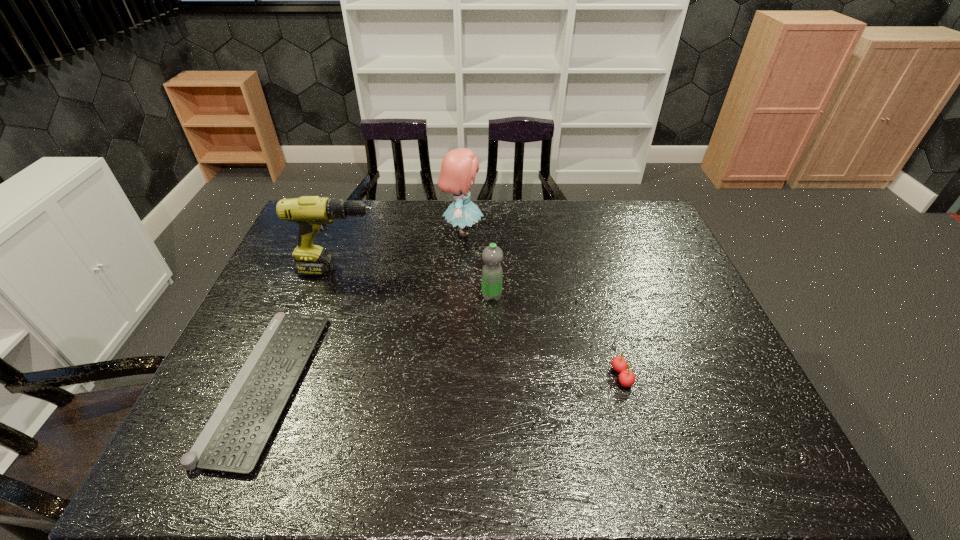
At what (x,y) coordinates should I click in order to perform the action: click on free point between the doll and the third tallest object. Please return your answer as a coordinate pair (x, y). Image resolution: width=960 pixels, height=540 pixels. Looking at the image, I should click on (477, 264).

Find the location of a particular element. vacant space that is in between the doll and the water bottle is located at coordinates (477, 264).

This screenshot has width=960, height=540. I want to click on vacant point located between the drill and the water bottle, so click(x=416, y=283).

At what (x,y) coordinates should I click in order to perform the action: click on vacant point located between the farthest object and the rightmost object. Please return your answer as a coordinate pair (x, y). The height and width of the screenshot is (540, 960). Looking at the image, I should click on (541, 303).

Locate an element on the screen. The image size is (960, 540). free spot between the farthest object and the computer keyboard is located at coordinates (365, 307).

Where is `free space between the doll and the drill`? This screenshot has width=960, height=540. free space between the doll and the drill is located at coordinates (401, 251).

I want to click on vacant area that lies between the fourth tallest object and the drill, so click(x=481, y=323).

Find the location of a particular element. free point between the second farthest object and the water bottle is located at coordinates (416, 283).

Where is `vacant point located between the computer keyboard and the water bottle`? vacant point located between the computer keyboard and the water bottle is located at coordinates (380, 340).

The width and height of the screenshot is (960, 540). I want to click on the second closest object to the shortest object, so click(x=459, y=166).